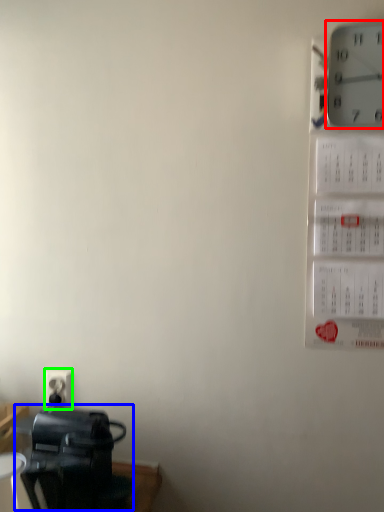
Question: Which object is positioned farthest from wall clock (highlighted by a red box)? Select from appliance (highlighted by a blue box) and electric outlet (highlighted by a green box).

Choices:
 (A) appliance
 (B) electric outlet

Answer: (B)